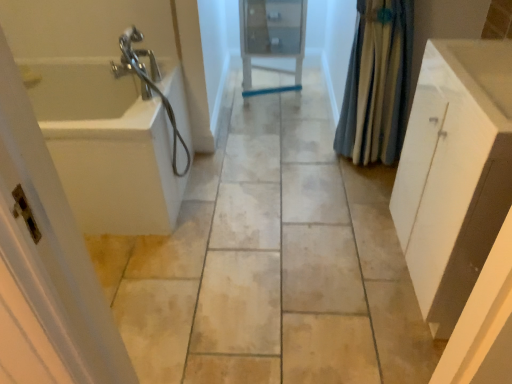
What do you see at coordinates (483, 74) in the screenshot? Image resolution: width=512 pixels, height=384 pixels. I see `white glossy sink at right` at bounding box center [483, 74].

What do you see at coordinates (106, 146) in the screenshot? The image size is (512, 384). I see `white glossy bathtub at left` at bounding box center [106, 146].

At what (x,y) coordinates should I click in order to perform the action: click on blue fabric shower curtain at right. Please return your answer as a coordinate pair (x, y). This screenshot has height=384, width=512. Looking at the image, I should click on (377, 83).

This screenshot has width=512, height=384. I want to click on white plastic screen door at left, so click(x=46, y=264).

In order to click on white glossy sink at right in this screenshot , I will do (483, 74).

Which is more to the left, white glossy sink at right or white matte cabinet at right?

white glossy sink at right is more to the left.

Which object is further away from the camera, white glossy sink at right or white matte cabinet at right?

white matte cabinet at right is further away from the camera.

This screenshot has height=384, width=512. Find the location of `counter top lying above the white matte cabinet at right (from the image's perspective)`. counter top lying above the white matte cabinet at right (from the image's perspective) is located at coordinates 483,74.

Would you say white glossy sink at right contains white matte cabinet at right?

No, white matte cabinet at right is not surrounded by white glossy sink at right.

Looking at this image, would you say white plastic screen door at left is outside matte glass medicine cabinet at center?

Yes, white plastic screen door at left is outside of matte glass medicine cabinet at center.

Which object is thinner, white plastic screen door at left or matte glass medicine cabinet at center?

white plastic screen door at left is thinner.

From a real-world perspective, is white plastic screen door at left physically above matte glass medicine cabinet at center?

Yes, from a real-world perspective, white plastic screen door at left is on top of matte glass medicine cabinet at center.

Is white plastic screen door at left to the right of matte glass medicine cabinet at center from the viewer's perspective?

No.

The width and height of the screenshot is (512, 384). I want to click on medicine cabinet beneath the blue fabric shower curtain at right (from a real-world perspective), so click(x=272, y=38).

Which object is positioned more to the right, blue fabric shower curtain at right or matte glass medicine cabinet at center?

blue fabric shower curtain at right is more to the right.

Is blue fabric shower curtain at right thinner than matte glass medicine cabinet at center?

Indeed, blue fabric shower curtain at right has a lesser width compared to matte glass medicine cabinet at center.

Which is correct: blue fabric shower curtain at right is inside matte glass medicine cabinet at center, or outside of it?

The correct answer is: outside.

Who is bigger, white glossy bathtub at left or white plastic screen door at left?

white glossy bathtub at left.

Between point (103, 147) and point (111, 347), which one is positioned behind?

Point (103, 147)

Is white glossy bathtub at left facing away from white plastic screen door at left?

That's not correct — white glossy bathtub at left is not looking away from white plastic screen door at left.

Which of these two, white glossy bathtub at left or white plastic screen door at left, stands shorter?

white glossy bathtub at left is shorter.

Does white glossy sink at right have a greater height compared to blue fabric shower curtain at right?

In fact, white glossy sink at right may be shorter than blue fabric shower curtain at right.

Which is in front, white glossy sink at right or blue fabric shower curtain at right?

white glossy sink at right is more forward.

Can you tell me how much white glossy sink at right and blue fabric shower curtain at right differ in facing direction?

The angle between the facing direction of white glossy sink at right and the facing direction of blue fabric shower curtain at right is 88 degrees.

Is white glossy sink at right touching blue fabric shower curtain at right?

white glossy sink at right and blue fabric shower curtain at right are not in contact.

Considering the positions of objects blue fabric shower curtain at right and white plastic screen door at left in the image provided, who is behind, blue fabric shower curtain at right or white plastic screen door at left?

blue fabric shower curtain at right.

Is blue fabric shower curtain at right far from white plastic screen door at left?

Absolutely, blue fabric shower curtain at right is distant from white plastic screen door at left.

From a real-world perspective, is blue fabric shower curtain at right below white plastic screen door at left?

No, from a real-world perspective, blue fabric shower curtain at right is not below white plastic screen door at left.

Considering the sizes of objects blue fabric shower curtain at right and white plastic screen door at left in the image provided, who is bigger, blue fabric shower curtain at right or white plastic screen door at left?

blue fabric shower curtain at right is bigger.

Is matte glass medicine cabinet at center located outside blue fabric shower curtain at right?

Yes, matte glass medicine cabinet at center is outside of blue fabric shower curtain at right.

From the image's perspective, which object appears higher, matte glass medicine cabinet at center or blue fabric shower curtain at right?

matte glass medicine cabinet at center is shown above in the image.

From a real-world perspective, which object stands above the other?

blue fabric shower curtain at right is physically above.

Where is `counter top that appears above the white matte cabinet at right (from a real-world perspective)`? Image resolution: width=512 pixels, height=384 pixels. counter top that appears above the white matte cabinet at right (from a real-world perspective) is located at coordinates (483, 74).

I want to click on screen door in front of the matte glass medicine cabinet at center, so click(x=46, y=264).

From the image, which object appears to be farther from white matte cabinet at right, white glossy bathtub at left or white plastic screen door at left?

white glossy bathtub at left is positioned further to the anchor white matte cabinet at right.

When comparing their distances from white plastic screen door at left, does blue fabric shower curtain at right or matte glass medicine cabinet at center seem further?

Among the two, matte glass medicine cabinet at center is located further to white plastic screen door at left.

Looking at the image, which one is located further to white plastic screen door at left, matte glass medicine cabinet at center or white glossy bathtub at left?

The object further to white plastic screen door at left is matte glass medicine cabinet at center.

Looking at the image, which one is located further to blue fabric shower curtain at right, matte glass medicine cabinet at center or white glossy bathtub at left?

Among the two, white glossy bathtub at left is located further to blue fabric shower curtain at right.

Estimate the real-world distances between objects in this image. Which object is closer to white glossy bathtub at left, matte glass medicine cabinet at center or white plastic screen door at left?

The object closer to white glossy bathtub at left is matte glass medicine cabinet at center.

When comparing their distances from white matte cabinet at right, does white glossy bathtub at left or blue fabric shower curtain at right seem further?

Based on the image, white glossy bathtub at left appears to be further to white matte cabinet at right.

Looking at the image, which one is located further to matte glass medicine cabinet at center, white glossy sink at right or white plastic screen door at left?

The object further to matte glass medicine cabinet at center is white plastic screen door at left.

From the image, which object appears to be nearer to white glossy bathtub at left, white matte cabinet at right or white plastic screen door at left?

white plastic screen door at left lies closer to white glossy bathtub at left than the other object.

Where is `counter top between white glossy bathtub at left and white matte cabinet at right from left to right`? The image size is (512, 384). counter top between white glossy bathtub at left and white matte cabinet at right from left to right is located at coordinates (483, 74).

The image size is (512, 384). Identify the location of bathroom cabinet between white glossy sink at right and matte glass medicine cabinet at center from front to back. (454, 172).

In order to click on medicine cabinet between white glossy bathtub at left and white matte cabinet at right in the horizontal direction in this screenshot , I will do `click(272, 38)`.

You are a GUI agent. You are given a task and a screenshot of the screen. Output one action in this format:
    pyautogui.click(x=<x>, y=<y>)
    Task: Click on the counter top between white plastic screen door at left and matte glass medicine cabinet at center from front to back
    Image resolution: width=512 pixels, height=384 pixels.
    Given the screenshot: What is the action you would take?
    pyautogui.click(x=483, y=74)